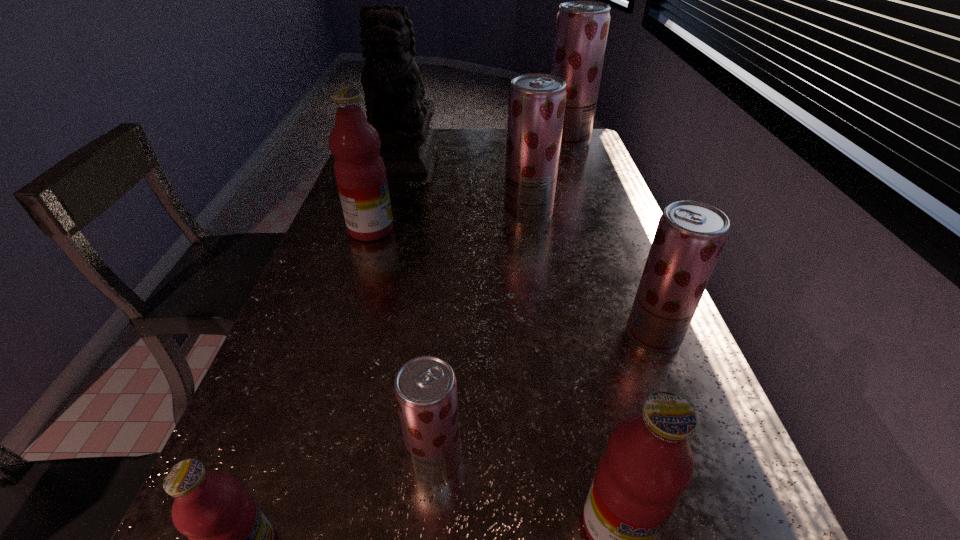
You are a GUI agent. You are given a task and a screenshot of the screen. Output one action in this format:
    pyautogui.click(x=<x>, y=<y>)
    Task: Click on the object present at the far left corner
    The height and width of the screenshot is (540, 960).
    Given the screenshot: What is the action you would take?
    pyautogui.click(x=393, y=88)

This screenshot has height=540, width=960. Identify the location of object present at the far right corner. (582, 27).

Find the location of `free space at the left edge of the desktop`. free space at the left edge of the desktop is located at coordinates (310, 333).

Locate an element on the screen. The image size is (960, 540). vacant space at the right edge of the desktop is located at coordinates (588, 276).

Where is `free space at the far right corner`? free space at the far right corner is located at coordinates (595, 156).

The width and height of the screenshot is (960, 540). In order to click on vacant space that's between the second strawberry fruit juice from left to right and the sculpture in this screenshot , I will do `click(466, 186)`.

Find the location of a particular element. unoccupied position between the farthest fruit juice and the sculpture is located at coordinates (486, 150).

I want to click on blank region between the tallest fruit juice and the biggest pink fruit juice, so click(469, 186).

This screenshot has height=540, width=960. What are the coordinates of `free point between the nearest strawberry fruit juice and the sculpture` in the screenshot? It's located at (420, 310).

Locate an element on the screen. The width and height of the screenshot is (960, 540). unoccupied area between the second biggest strawberry fruit juice and the sculpture is located at coordinates (466, 186).